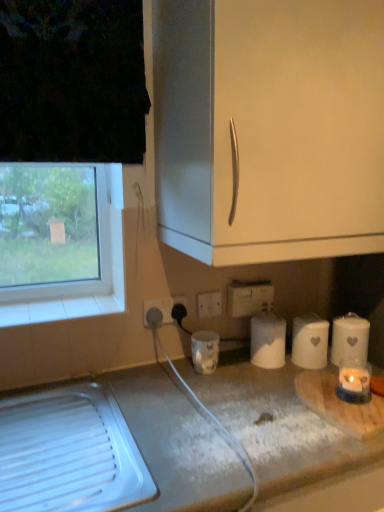
Describe the element at coordinates (163, 308) in the screenshot. This screenshot has width=384, height=512. I see `white plastic electric outlet at lower center, which is counted as the second electric outlet, starting from the right` at that location.

What do you see at coordinates (249, 298) in the screenshot? The height and width of the screenshot is (512, 384). I see `white plastic electric outlet at lower center, the first electric outlet positioned from the back` at bounding box center [249, 298].

Find the location of a particular element. white matte countertop at lower center is located at coordinates (278, 425).

Is the position of white matte paper towel at lower right, which ranks as the 3th paper towel in left-to-right order, more distant than that of translucent glass candle at lower right?

Yes, white matte paper towel at lower right, which ranks as the 3th paper towel in left-to-right order, is behind translucent glass candle at lower right.

Is white matte paper towel at lower right, which ranks as the 3th paper towel in left-to-right order, next to translucent glass candle at lower right?

Yes, white matte paper towel at lower right, which ranks as the 3th paper towel in left-to-right order, is touching translucent glass candle at lower right.

Does white matte paper towel at lower right, the 1th paper towel when ordered from right to left, have a larger size compared to translucent glass candle at lower right?

Yes, white matte paper towel at lower right, the 1th paper towel when ordered from right to left, is bigger than translucent glass candle at lower right.

From a real-world perspective, is white matte paper towel at lower right, the 1th paper towel when ordered from right to left, over translucent glass candle at lower right?

Yes, from a real-world perspective, white matte paper towel at lower right, the 1th paper towel when ordered from right to left, is above translucent glass candle at lower right.

Can you confirm if white plastic electric outlet at lower center, the first electric outlet positioned from the back, is wider than white plastic power plugs and sockets at lower center?

Correct, the width of white plastic electric outlet at lower center, the first electric outlet positioned from the back, exceeds that of white plastic power plugs and sockets at lower center.

Is white plastic power plugs and sockets at lower center located within white plastic electric outlet at lower center, the first electric outlet positioned from the back?

No, white plastic electric outlet at lower center, the first electric outlet positioned from the back, does not contain white plastic power plugs and sockets at lower center.

Can you see white plastic electric outlet at lower center, the 2th electric outlet from the front, touching white plastic power plugs and sockets at lower center?

Yes, white plastic electric outlet at lower center, the 2th electric outlet from the front, is right next to white plastic power plugs and sockets at lower center and making contact.

In the image, is white plastic electric outlet at lower center, which ranks as the 2th electric outlet in left-to-right order, positioned in front of or behind white plastic power plugs and sockets at lower center?

In the image, white plastic electric outlet at lower center, which ranks as the 2th electric outlet in left-to-right order, appears behind white plastic power plugs and sockets at lower center.

Between white matte cabinet handle at upper center and translucent glass candle at lower right, which one has larger width?

With larger width is white matte cabinet handle at upper center.

Is white matte cabinet handle at upper center touching translucent glass candle at lower right?

white matte cabinet handle at upper center is not next to translucent glass candle at lower right, and they're not touching.

Considering the relative positions of white matte cabinet handle at upper center and translucent glass candle at lower right in the image provided, is white matte cabinet handle at upper center in front of translucent glass candle at lower right?

Yes, white matte cabinet handle at upper center is closer to the camera.

Considering the positions of objects transparent glass window at left and white matte paper towel at center, which is the first paper towel from left to right, in the image provided, who is in front, transparent glass window at left or white matte paper towel at center, which is the first paper towel from left to right,?

transparent glass window at left is closer to the camera.

From the image's perspective, is transparent glass window at left above or below white matte paper towel at center, the third paper towel when ordered from right to left?

From the image's perspective, transparent glass window at left appears above white matte paper towel at center, the third paper towel when ordered from right to left.

Are transparent glass window at left and white matte paper towel at center, which is the first paper towel from left to right, making contact?

transparent glass window at left and white matte paper towel at center, which is the first paper towel from left to right, are clearly separated.

Is the position of wooden cutting board at lower right less distant than that of white plastic electric outlet at lower center, the 1th electric outlet in the left-to-right sequence?

Yes, wooden cutting board at lower right is closer to the viewer.

Between wooden cutting board at lower right and white plastic electric outlet at lower center, which is counted as the second electric outlet, starting from the right, which one has larger size?

wooden cutting board at lower right is bigger.

From a real-world perspective, is wooden cutting board at lower right on white plastic electric outlet at lower center, acting as the second electric outlet starting from the back?

Actually, wooden cutting board at lower right is physically below white plastic electric outlet at lower center, acting as the second electric outlet starting from the back, in the real world.

Is white matte cabinet handle at upper center located outside transparent glass window at left?

Yes.

Which of these two, white matte cabinet handle at upper center or transparent glass window at left, stands shorter?

transparent glass window at left.

In terms of size, does white matte cabinet handle at upper center appear bigger or smaller than transparent glass window at left?

Clearly, white matte cabinet handle at upper center is larger in size than transparent glass window at left.

Between white matte cabinet handle at upper center and transparent glass window at left, which one appears on the right side from the viewer's perspective?

From the viewer's perspective, white matte cabinet handle at upper center appears more on the right side.

Which point is more distant from viewer, (200, 296) or (169, 313)?

Point (200, 296)

Is white plastic power plugs and sockets at lower center positioned beyond the bounds of white plastic electric outlet at lower center, the 1th electric outlet in the left-to-right sequence?

Yes.

Looking at their sizes, would you say white plastic power plugs and sockets at lower center is wider or thinner than white plastic electric outlet at lower center, which is counted as the second electric outlet, starting from the right?

In the image, white plastic power plugs and sockets at lower center appears to be more narrow than white plastic electric outlet at lower center, which is counted as the second electric outlet, starting from the right.

Which of these two, white plastic power plugs and sockets at lower center or white plastic electric outlet at lower center, which is counted as the second electric outlet, starting from the right, stands shorter?

white plastic power plugs and sockets at lower center.

Image resolution: width=384 pixels, height=512 pixels. Find the location of `candle holder beneath the white matte paper towel at lower right, which ranks as the 3th paper towel in left-to-right order (from a real-world perspective)`. candle holder beneath the white matte paper towel at lower right, which ranks as the 3th paper towel in left-to-right order (from a real-world perspective) is located at coordinates (354, 381).

There is a white plastic power plugs and sockets at lower center. What are the coordinates of `the 2nd electric outlet above it (from a real-world perspective)` in the screenshot? It's located at (249, 298).

When comparing their distances from white matte paper towel at center, which is the first paper towel from left to right, does white plastic electric outlet at lower center, acting as the second electric outlet starting from the back, or white matte paper towel at lower right, which ranks as the 3th paper towel in left-to-right order, seem closer?

white matte paper towel at lower right, which ranks as the 3th paper towel in left-to-right order, is positioned closer to the anchor white matte paper towel at center, which is the first paper towel from left to right.

From the image, which object appears to be farther from white plastic power plugs and sockets at lower center, white matte paper towel at center, the third paper towel when ordered from right to left, or white matte countertop at lower center?

white matte countertop at lower center.

Based on their spatial positions, is white matte paper towel at lower right, which ranks as the 3th paper towel in left-to-right order, or translucent glass candle at lower right closer to white matte paper towel at center, the third paper towel when ordered from right to left?

Among the two, white matte paper towel at lower right, which ranks as the 3th paper towel in left-to-right order, is located nearer to white matte paper towel at center, the third paper towel when ordered from right to left.

Consider the image. From the image, which object appears to be nearer to white ceramic candle at lower center, white matte countertop at lower center or wooden cutting board at lower right?

white matte countertop at lower center is positioned closer to the anchor white ceramic candle at lower center.

Estimate the real-world distances between objects in this image. Which object is closer to white ceramic candle at lower center, wooden cutting board at lower right or white matte cabinet handle at upper center?

wooden cutting board at lower right is positioned closer to the anchor white ceramic candle at lower center.

Which object lies further to the anchor point transparent glass window at left, white matte paper towel at lower right, the 1th paper towel when ordered from right to left, or white ceramic candle at lower center?

white matte paper towel at lower right, the 1th paper towel when ordered from right to left.

From the picture: Estimate the real-world distances between objects in this image. Which object is closer to white matte cabinet handle at upper center, white plastic electric outlet at lower center, the 2th electric outlet from the front, or white matte paper towel at lower right, the 1th paper towel when ordered from right to left?

Based on the image, white plastic electric outlet at lower center, the 2th electric outlet from the front, appears to be nearer to white matte cabinet handle at upper center.

Based on their spatial positions, is white matte paper towel at lower right, marked as the second paper towel in a right-to-left arrangement, or white plastic electric outlet at lower center, acting as the second electric outlet starting from the back, closer to white matte countertop at lower center?

white matte paper towel at lower right, marked as the second paper towel in a right-to-left arrangement, lies closer to white matte countertop at lower center than the other object.

Identify the location of paper towel between translucent glass candle at lower right and white matte paper towel at lower right, which ranks as the 3th paper towel in left-to-right order, from front to back. Image resolution: width=384 pixels, height=512 pixels. (310, 342).

At what (x,y) coordinates should I click in order to perform the action: click on appliance between white matte countertop at lower center and white plastic electric outlet at lower center, acting as the second electric outlet starting from the back, from front to back. Please return your answer as a coordinate pair (x, y). Looking at the image, I should click on (205, 351).

Identify the location of cabinetry between transparent glass window at left and white matte paper towel at lower right, the 1th paper towel when ordered from right to left, from left to right. (269, 127).

Where is `electric outlet located between white plastic electric outlet at lower center, the first electric outlet positioned from the front, and white matte paper towel at center, which is the first paper towel from left to right, in the left-right direction`? The width and height of the screenshot is (384, 512). electric outlet located between white plastic electric outlet at lower center, the first electric outlet positioned from the front, and white matte paper towel at center, which is the first paper towel from left to right, in the left-right direction is located at coordinates (249, 298).